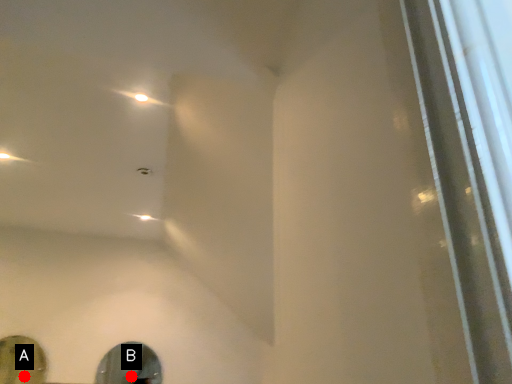
Question: Two points are circled on the image, labeled by A and B beside each circle. Which point appears farthest from the camera in this image?

Choices:
 (A) A is further
 (B) B is further

Answer: (B)